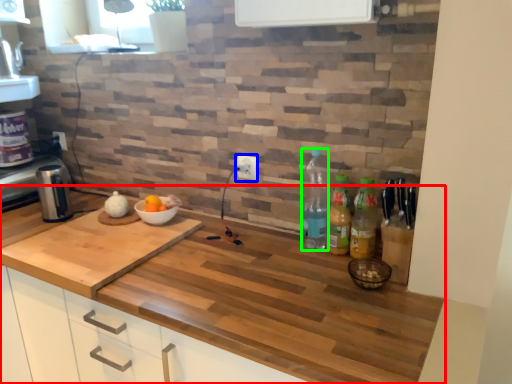
Question: Which object is the farthest from countertop (highlighted by a red box)? Choose among these: electric outlet (highlighted by a blue box) or bottle (highlighted by a green box).

Choices:
 (A) electric outlet
 (B) bottle

Answer: (A)